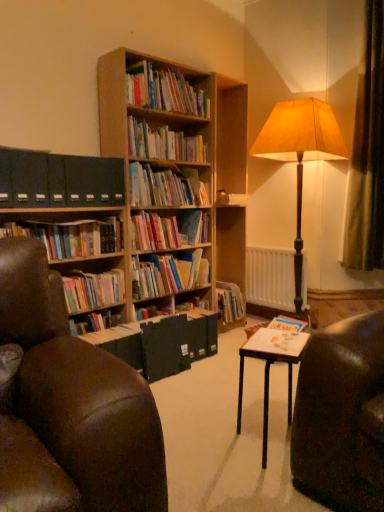
Question: Considering the relative sizes of hardcover books at left, the fifth book when ordered from top to bottom, and black matte file folders at left in the image provided, is hardcover books at left, the fifth book when ordered from top to bottom, bigger than black matte file folders at left?

Choices:
 (A) no
 (B) yes

Answer: (B)

Question: Does hardcover books at left, marked as the 3th book in a bottom-to-top arrangement, have a greater height compared to black matte file folders at left?

Choices:
 (A) yes
 (B) no

Answer: (B)

Question: Could you tell me if hardcover books at left, the fifth book when ordered from top to bottom, is facing black matte file folders at left?

Choices:
 (A) yes
 (B) no

Answer: (B)

Question: Is hardcover books at left, the fifth book when ordered from top to bottom, at the right side of black matte file folders at left?

Choices:
 (A) no
 (B) yes

Answer: (A)

Question: Is hardcover books at left, the fifth book when ordered from top to bottom, not near black matte file folders at left?

Choices:
 (A) no
 (B) yes

Answer: (A)

Question: From the image's perspective, is hardcover books at left, marked as the 3th book in a bottom-to-top arrangement, below black matte file folders at left?

Choices:
 (A) no
 (B) yes

Answer: (B)

Question: Considering the relative sizes of hardcover books at center, placed as the fourth book when sorted from bottom to top, and wooden bookshelf at upper center, the first book from the top, in the image provided, is hardcover books at center, placed as the fourth book when sorted from bottom to top, smaller than wooden bookshelf at upper center, the first book from the top,?

Choices:
 (A) no
 (B) yes

Answer: (B)

Question: From the image's perspective, is hardcover books at center, placed as the fourth book when sorted from bottom to top, beneath wooden bookshelf at upper center, the first book from the top?

Choices:
 (A) yes
 (B) no

Answer: (A)

Question: Considering the relative positions of hardcover books at center, placed as the fourth book when sorted from bottom to top, and wooden bookshelf at upper center, the first book from the top, in the image provided, is hardcover books at center, placed as the fourth book when sorted from bottom to top, to the left of wooden bookshelf at upper center, the first book from the top, from the viewer's perspective?

Choices:
 (A) yes
 (B) no

Answer: (B)

Question: Does hardcover books at center, the fourth book when ordered from top to bottom, come behind wooden bookshelf at upper center, the first book from the top?

Choices:
 (A) no
 (B) yes

Answer: (B)

Question: Is hardcover books at center, the fourth book when ordered from top to bottom, wider than wooden bookshelf at upper center, the first book from the top?

Choices:
 (A) yes
 (B) no

Answer: (A)

Question: Is hardcover books at center, the fourth book when ordered from top to bottom, not near wooden bookshelf at upper center, the first book from the top?

Choices:
 (A) yes
 (B) no

Answer: (B)

Question: Considering the relative sizes of white matte radiator at center and hardcover books at center, positioned as the seventh book in top-to-bottom order, in the image provided, is white matte radiator at center taller than hardcover books at center, positioned as the seventh book in top-to-bottom order,?

Choices:
 (A) yes
 (B) no

Answer: (A)